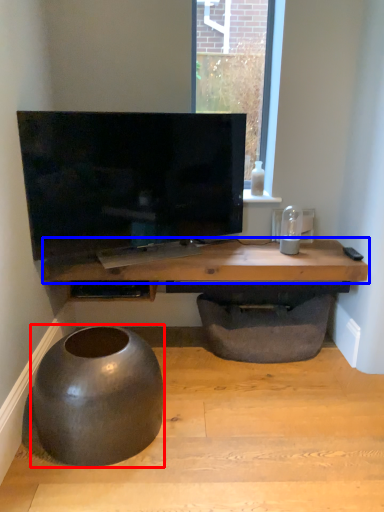
Question: Among these objects, which one is farthest to the camera, round table (highlighted by a red box) or table (highlighted by a blue box)?

Choices:
 (A) round table
 (B) table

Answer: (B)